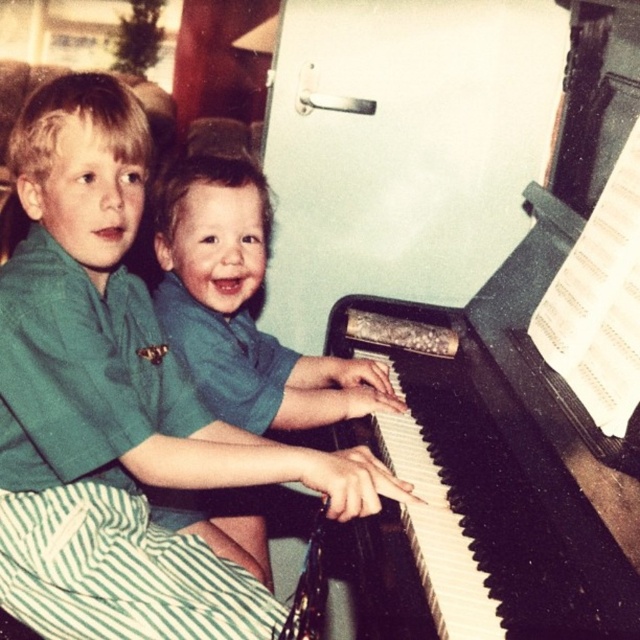
Between green cotton shirt at upper left and black polished piano at center, which one is positioned higher?

black polished piano at center

Is point (108, 529) positioned behind point (570, 144)?

No, (108, 529) is in front of (570, 144).

Is point (36, 132) positioned in front of point (524, 618)?

No, (36, 132) is behind (524, 618).

Find the location of a particular element. green cotton shirt at upper left is located at coordinates (116, 404).

Does black polished piano at center have a smaller size compared to green matte shirt at center?

No, black polished piano at center is not smaller than green matte shirt at center.

Who is lower down, black polished piano at center or green matte shirt at center?

black polished piano at center is below.

Measure the distance between point (x=618, y=563) and camera.

They are 34.73 inches apart.

Find the location of a particular element. black polished piano at center is located at coordinates (504, 419).

Is point (83, 378) farther from camera compared to point (163, 244)?

No, it is not.

Is green cotton shirt at upper left behind green matte shirt at center?

No, it is in front of green matte shirt at center.

This screenshot has width=640, height=640. What are the coordinates of `green cotton shirt at upper left` in the screenshot? It's located at (116, 404).